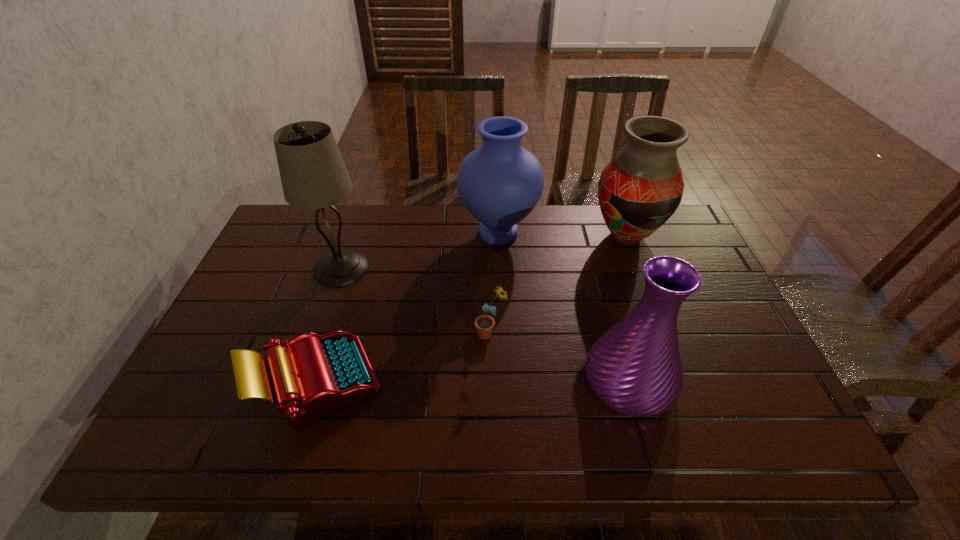
Locate an element on the screen. The image size is (960, 540). object that stands as the closest to the typewriter is located at coordinates (313, 174).

Choose which vase is the second nearest neighbor to the leftmost vase. Please provide its 2D coordinates. Your answer should be formatted as a tuple, i.e. [(x, y)], where the tuple contains the x and y coordinates of a point satisfying the conditions above.

[(635, 368)]

Locate an element on the screen. Image resolution: width=960 pixels, height=540 pixels. vase that is the second nearest to the nearest vase is located at coordinates (500, 183).

Identify the location of free spot that satisfies the following two spatial constraints: 1. on the front side of the leftmost vase; 2. on the flower of the sunflower. The image size is (960, 540). (503, 334).

Image resolution: width=960 pixels, height=540 pixels. I want to click on free point that satisfies the following two spatial constraints: 1. on the flower of the second shortest object; 2. on the left side of the nearest vase, so click(492, 382).